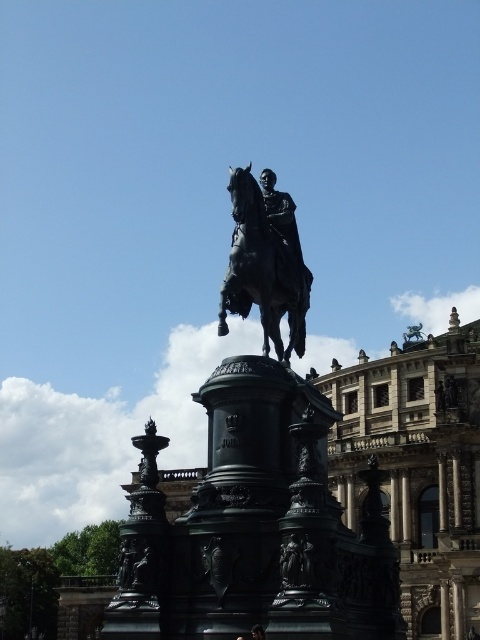
How distant is black polished statue at center from shiny black horse at center?

black polished statue at center is 15.52 feet from shiny black horse at center.

Which of these two, black polished statue at center or shiny black horse at center, stands shorter?

shiny black horse at center

The height and width of the screenshot is (640, 480). Identify the location of black polished statue at center. (255, 497).

Is black polished statue at center wider than dark brown hair at center?

Yes, black polished statue at center is wider than dark brown hair at center.

Who is taller, black polished statue at center or dark brown hair at center?

black polished statue at center

Identify the location of black polished statue at center. (x=255, y=497).

Can you confirm if shiny black horse at center is bigger than dark brown hair at center?

Yes, shiny black horse at center is bigger than dark brown hair at center.

Between point (268, 234) and point (254, 636), which one is positioned behind?

Positioned behind is point (268, 234).

Find the location of a particular element. The height and width of the screenshot is (640, 480). shiny black horse at center is located at coordinates (265, 260).